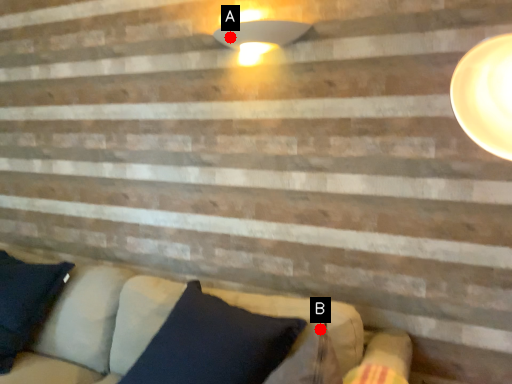
Question: Two points are circled on the image, labeled by A and B beside each circle. Which of the following is the farthest from the observer?

Choices:
 (A) A is further
 (B) B is further

Answer: (A)